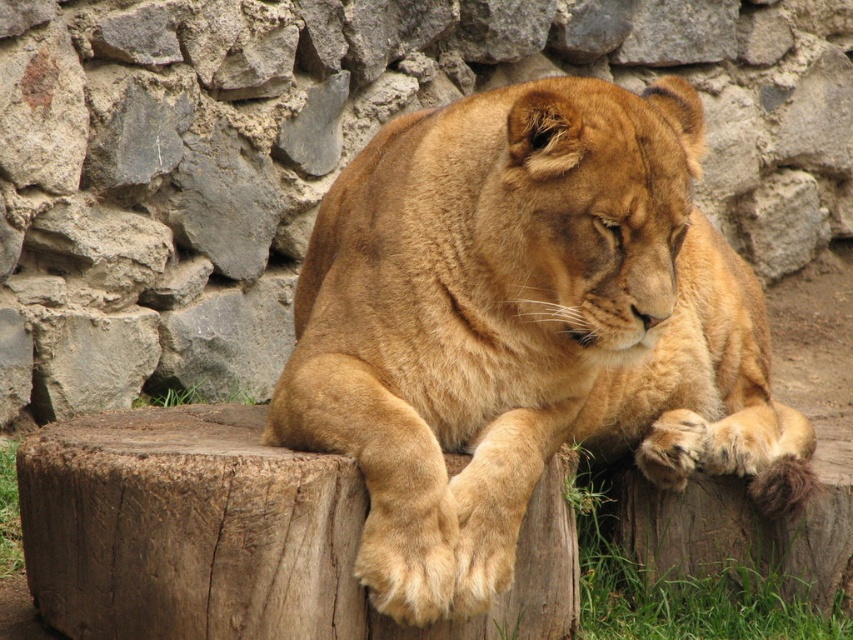
Question: Is golden fur lion at center bigger than green grass at lower left?

Choices:
 (A) yes
 (B) no

Answer: (A)

Question: Which point is closer to the camera?

Choices:
 (A) (751, 522)
 (B) (654, 433)

Answer: (B)

Question: Is the position of golden fur lion at center less distant than that of green grass at lower left?

Choices:
 (A) no
 (B) yes

Answer: (B)

Question: Is golden fur lion at center positioned in front of green grass at lower left?

Choices:
 (A) yes
 (B) no

Answer: (A)

Question: Which point is closer to the camera?

Choices:
 (A) click(656, 605)
 (B) click(508, 284)

Answer: (B)

Question: Which point is farther to the camera?

Choices:
 (A) green grass at lower right
 (B) green grass at lower left

Answer: (B)